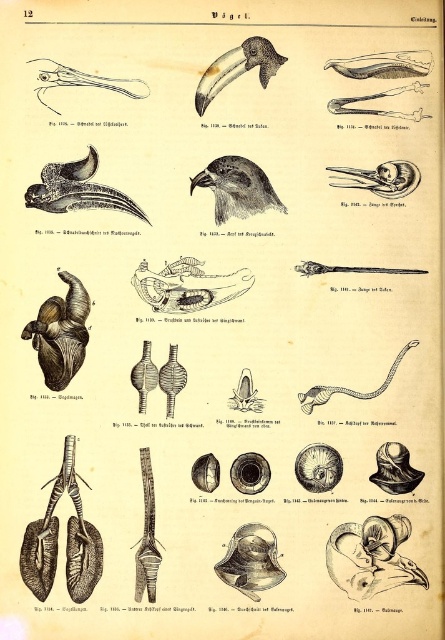
Consider the image. You are a student examining the bird anatomy illustration. You notice the brown textured bird at center and the black glossy beak at upper center. Which object is shorter in height?

The brown textured bird at center has a lesser height compared to the black glossy beak at upper center, so the brown textured bird at center is shorter in height.

You are a student studying bird anatomy. You have to locate the brown textured bird at center and the black glossy beak at upper center in your textbook. Based on their positions, which object is closer to the right edge of the page?

The brown textured bird at center is closer to the right edge of the page because it is positioned to the right of the black glossy beak at upper center.